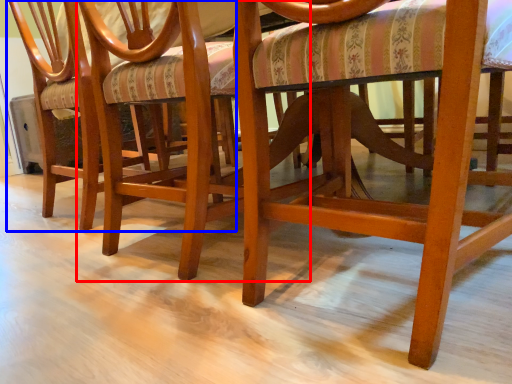
Question: Which point is further to the camera, chair (highlighted by a red box) or chair (highlighted by a blue box)?

Choices:
 (A) chair
 (B) chair

Answer: (B)